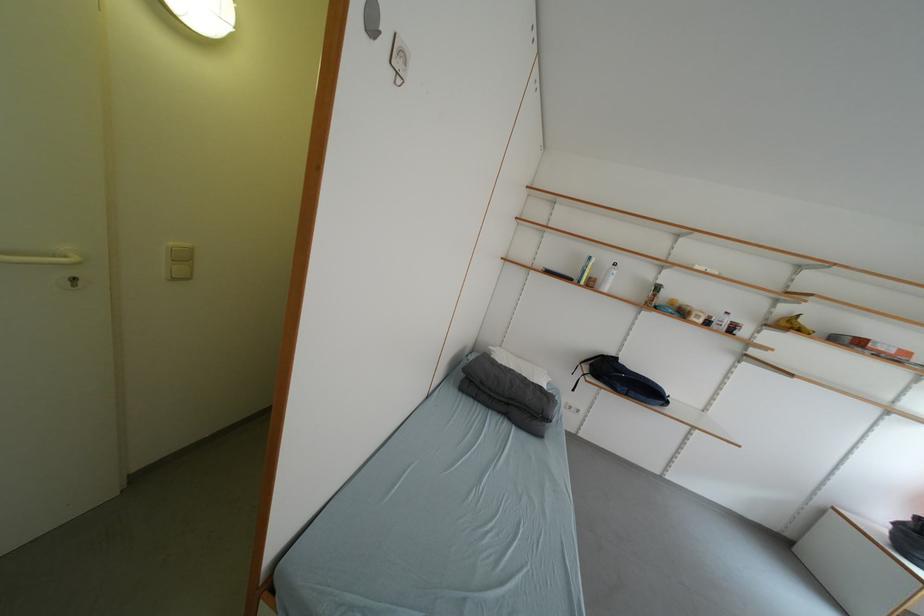
The width and height of the screenshot is (924, 616). I want to click on grey wall hook, so click(398, 60).